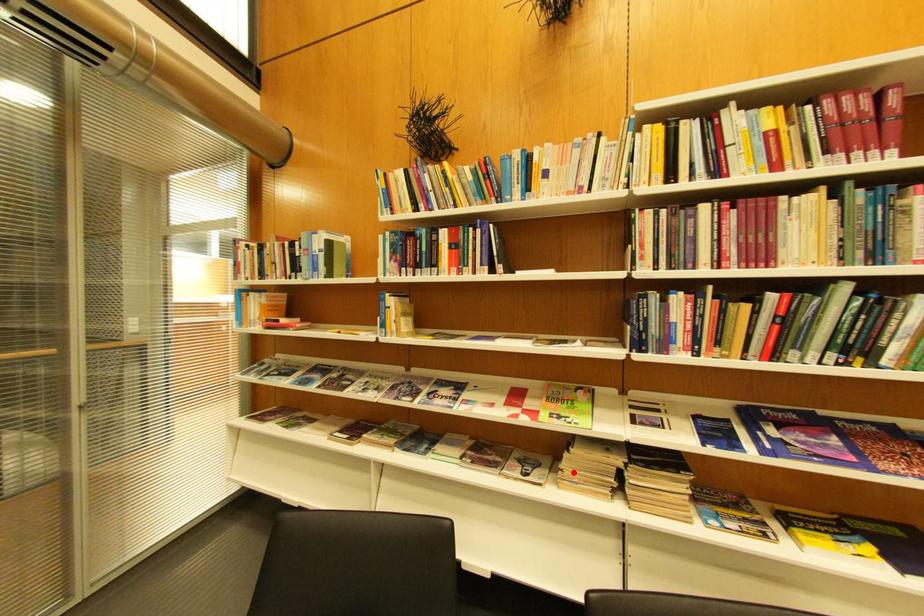
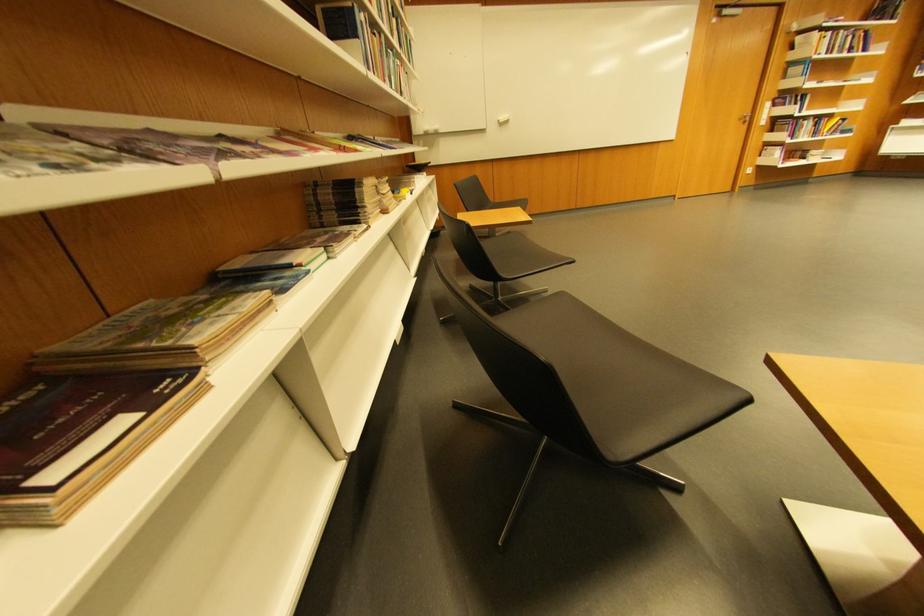
Find the pixel in the second image that matches the highlighted location in the first image.

(379, 207)